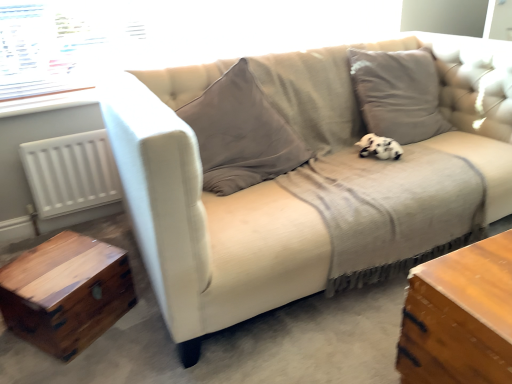
Locate an element on the screen. The width and height of the screenshot is (512, 384). black and white plush at center is located at coordinates (379, 147).

I want to click on white matte radiator at left, so click(x=71, y=173).

From a real-world perspective, which is physically below, black and white plush at center or wooden trunk at lower left?

wooden trunk at lower left, from a real-world perspective.

Is black and white plush at center in front of or behind wooden trunk at lower left in the image?

Clearly, black and white plush at center is behind wooden trunk at lower left.

Find the location of a particular element. animal above the wooden trunk at lower left (from a real-world perspective) is located at coordinates (379, 147).

From a real-world perspective, relative to white matte radiator at left, is beige fabric couch at center vertically above or below?

In terms of real-world spatial position, beige fabric couch at center is above white matte radiator at left.

Considering the positions of objects beige fabric couch at center and white matte radiator at left in the image provided, who is more to the left, beige fabric couch at center or white matte radiator at left?

white matte radiator at left is more to the left.

Which object is wider, beige fabric couch at center or white matte radiator at left?

beige fabric couch at center is wider.

Considering the points (41, 169) and (313, 56), which point is in front, point (41, 169) or point (313, 56)?

The point (41, 169) is closer.

Looking at their sizes, would you say white matte radiator at left is wider or thinner than beige fabric couch at center?

white matte radiator at left is thinner than beige fabric couch at center.

Where is `studio couch in front of the white matte radiator at left`? The height and width of the screenshot is (384, 512). studio couch in front of the white matte radiator at left is located at coordinates (205, 214).

Considering the positions of point (7, 62) and point (102, 102), is point (7, 62) closer or farther from the camera than point (102, 102)?

Point (7, 62) is farther from the camera than point (102, 102).

Is transparent glass window at upper left bigger or smaller than beige fabric couch at center?

Clearly, transparent glass window at upper left is smaller in size than beige fabric couch at center.

Is beige fabric couch at center at the back of transparent glass window at upper left?

transparent glass window at upper left is not turned away from beige fabric couch at center.

From a real-world perspective, is wooden trunk at lower left positioned over beige fabric couch at center based on gravity?

Actually, wooden trunk at lower left is physically below beige fabric couch at center in the real world.

Which point is more distant from viewer, (81, 241) or (195, 189)?

The point (81, 241) is more distant.

Considering the relative positions of wooden trunk at lower left and beige fabric couch at center in the image provided, is wooden trunk at lower left to the right of beige fabric couch at center from the viewer's perspective?

Incorrect, wooden trunk at lower left is not on the right side of beige fabric couch at center.

Relative to beige fabric couch at center, is wooden trunk at lower left in front or behind?

Visually, wooden trunk at lower left is located behind beige fabric couch at center.

Is black and white plush at center next to white matte radiator at left?

No, black and white plush at center is not touching white matte radiator at left.

Is white matte radiator at left at the back of black and white plush at center?

That's not correct — black and white plush at center is not looking away from white matte radiator at left.

Which object is closer to the camera, black and white plush at center or white matte radiator at left?

black and white plush at center is more forward.

Is black and white plush at center wider than white matte radiator at left?

Yes.

This screenshot has height=384, width=512. In order to click on table on the right of white matte radiator at left in this screenshot , I will do `click(66, 293)`.

Can we say wooden trunk at lower left lies outside white matte radiator at left?

Yes.

Considering the points (115, 252) and (56, 200), which point is behind, point (115, 252) or point (56, 200)?

The point (56, 200) is behind.

Consider the image. Is wooden trunk at lower left far from white matte radiator at left?

No, wooden trunk at lower left is not far away from white matte radiator at left.

What are the coordinates of `table below the black and white plush at center (from a real-world perspective)` in the screenshot? It's located at (66, 293).

This screenshot has width=512, height=384. Identify the location of studio couch that appears above the white matte radiator at left (from a real-world perspective). (205, 214).

Which object lies further to the anchor point black and white plush at center, wooden trunk at lower left or white matte radiator at left?

Among the two, white matte radiator at left is located further to black and white plush at center.

Estimate the real-world distances between objects in this image. Which object is closer to white matte radiator at left, transparent glass window at upper left or wooden trunk at lower left?

transparent glass window at upper left is positioned closer to the anchor white matte radiator at left.

Considering their positions, is black and white plush at center positioned further to transparent glass window at upper left than white matte radiator at left?

Among the two, black and white plush at center is located further to transparent glass window at upper left.

From the picture: Which object lies nearer to the anchor point black and white plush at center, white matte radiator at left or transparent glass window at upper left?

transparent glass window at upper left lies closer to black and white plush at center than the other object.

Which object lies nearer to the anchor point wooden trunk at lower left, black and white plush at center or beige fabric couch at center?

Among the two, beige fabric couch at center is located nearer to wooden trunk at lower left.

Which object lies nearer to the anchor point white matte radiator at left, beige fabric couch at center or black and white plush at center?

Based on the image, beige fabric couch at center appears to be nearer to white matte radiator at left.

Based on their spatial positions, is beige fabric couch at center or wooden trunk at lower left closer to white matte radiator at left?

The object closer to white matte radiator at left is wooden trunk at lower left.

Looking at the image, which one is located closer to wooden trunk at lower left, white matte radiator at left or black and white plush at center?

white matte radiator at left is closer to wooden trunk at lower left.

Image resolution: width=512 pixels, height=384 pixels. In order to click on radiator between transparent glass window at upper left and wooden trunk at lower left from top to bottom in this screenshot , I will do `click(71, 173)`.

Where is `table between white matte radiator at left and black and white plush at center from left to right`? This screenshot has width=512, height=384. table between white matte radiator at left and black and white plush at center from left to right is located at coordinates (66, 293).

At what (x,y) coordinates should I click in order to perform the action: click on studio couch between white matte radiator at left and black and white plush at center in the horizontal direction. Please return your answer as a coordinate pair (x, y). The height and width of the screenshot is (384, 512). Looking at the image, I should click on (205, 214).

The height and width of the screenshot is (384, 512). What are the coordinates of `studio couch situated between wooden trunk at lower left and black and white plush at center from left to right` in the screenshot? It's located at (205, 214).